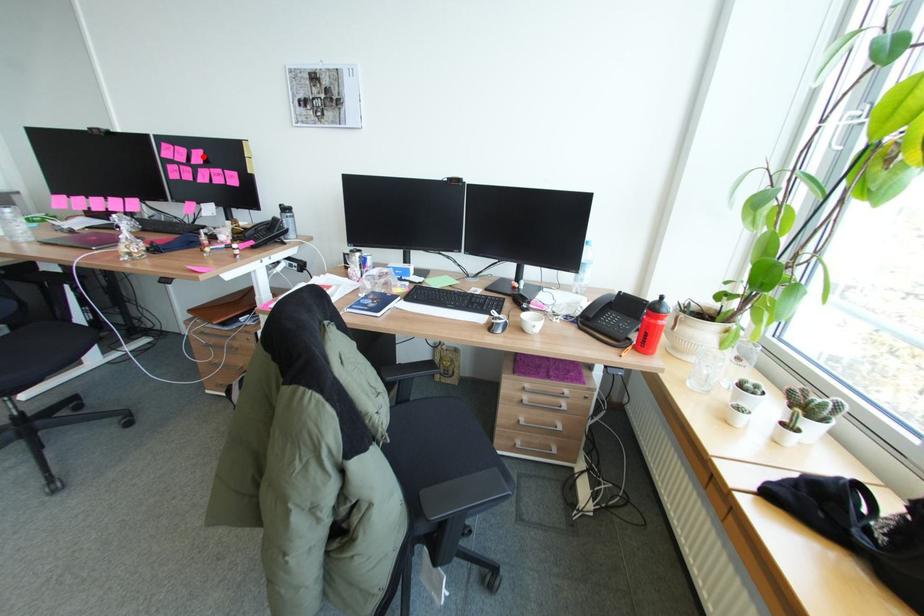
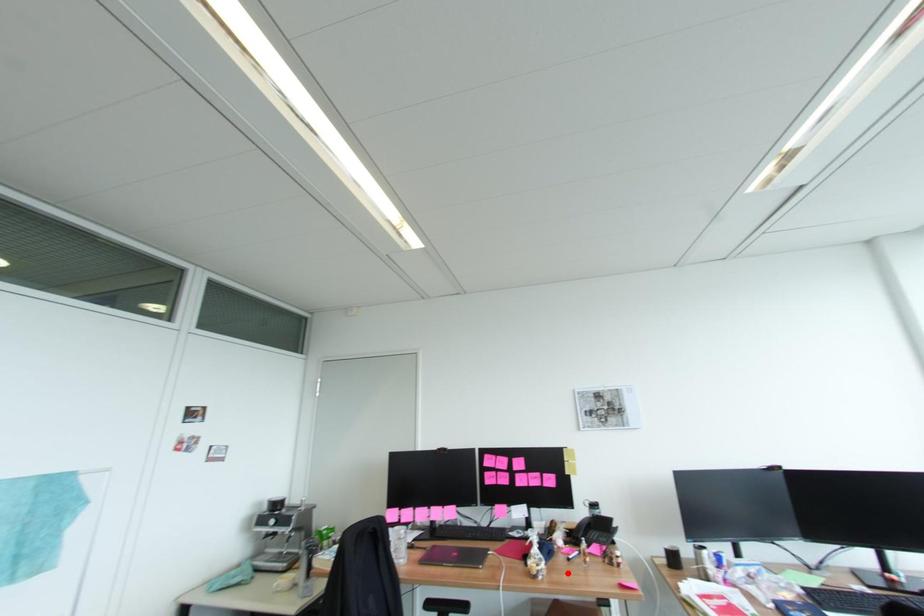
I am providing you with two images of the same scene from different viewpoints. A red point is marked on the first image and another point is marked on the second image. Does the point marked in image1 correspond to the same location as the one in image2?

No